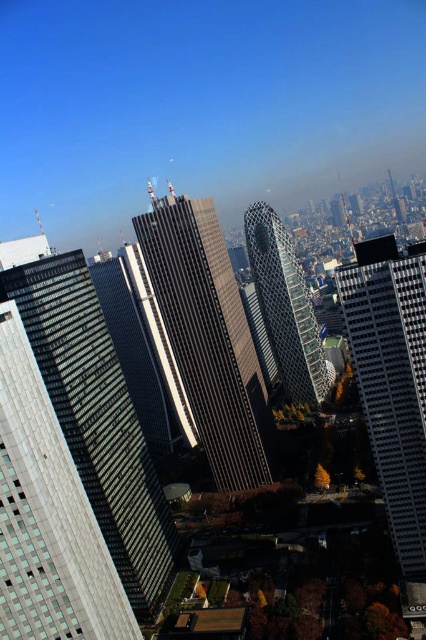
Question: Estimate the real-world distances between objects in this image. Which object is closer to the metallic glass skyscraper at center?

Choices:
 (A) silver glass skyscraper at center
 (B) glassy reflective skyscraper at center
 (C) glassy silver skyscraper at center

Answer: (A)

Question: In this image, where is glassy reflective skyscraper at center located relative to metallic glass skyscraper at center?

Choices:
 (A) above
 (B) below

Answer: (A)

Question: Which is farther from the metallic glass skyscraper at center?

Choices:
 (A) glassy reflective skyscraper at center
 (B) silver glass skyscraper at center
 (C) glassy silver skyscraper at center

Answer: (C)

Question: Is silver glass skyscraper at center closer to the viewer compared to glassy reflective skyscraper at center?

Choices:
 (A) no
 (B) yes

Answer: (B)

Question: Is glassy reflective skyscraper at center bigger than metallic glass skyscraper at center?

Choices:
 (A) yes
 (B) no

Answer: (A)

Question: Which point is closer to the camera?

Choices:
 (A) glassy reflective skyscraper at center
 (B) silver glass skyscraper at center

Answer: (B)